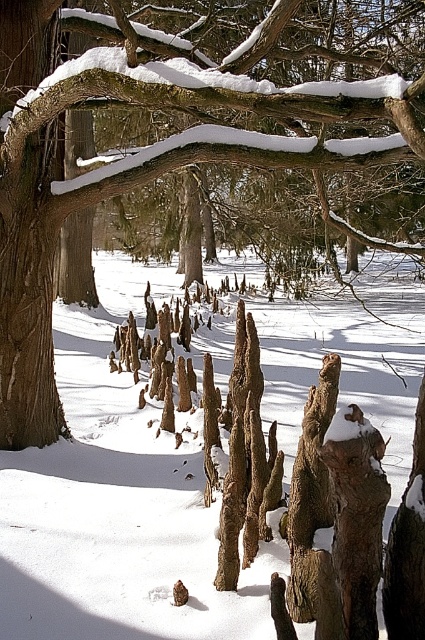
Question: Which of the following is the closest to the observer?

Choices:
 (A) pyautogui.click(x=339, y=161)
 (B) pyautogui.click(x=413, y=410)

Answer: (A)

Question: Among these points, which one is farthest from the camera?

Choices:
 (A) (172, 465)
 (B) (31, 60)

Answer: (A)

Question: Is white powdery snow at center further to the viewer compared to smooth bark tree trunk at center?

Choices:
 (A) yes
 (B) no

Answer: (A)

Question: Does white powdery snow at center appear on the left side of smooth bark tree trunk at center?

Choices:
 (A) no
 (B) yes

Answer: (A)

Question: Can you confirm if white powdery snow at center is bigger than smooth bark tree trunk at center?

Choices:
 (A) yes
 (B) no

Answer: (A)